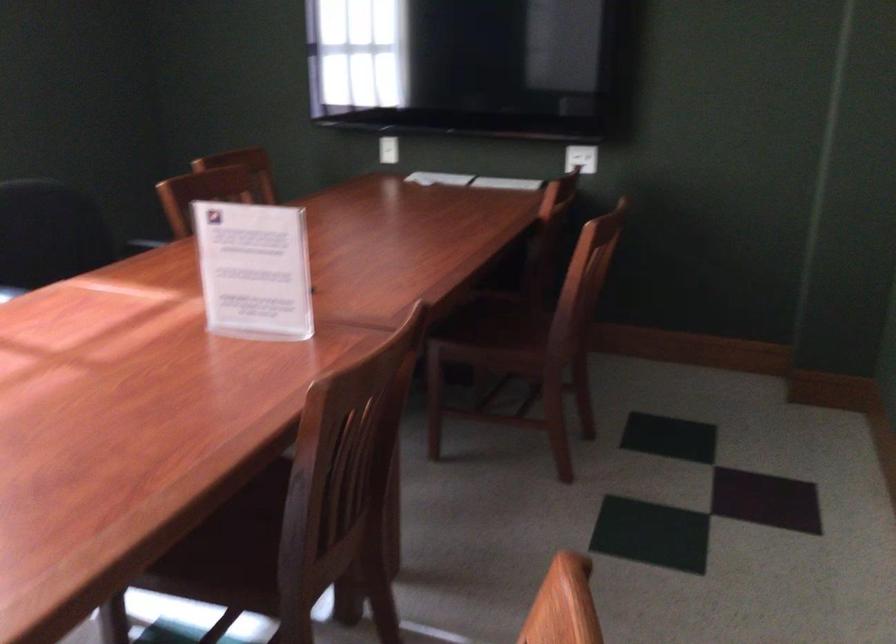
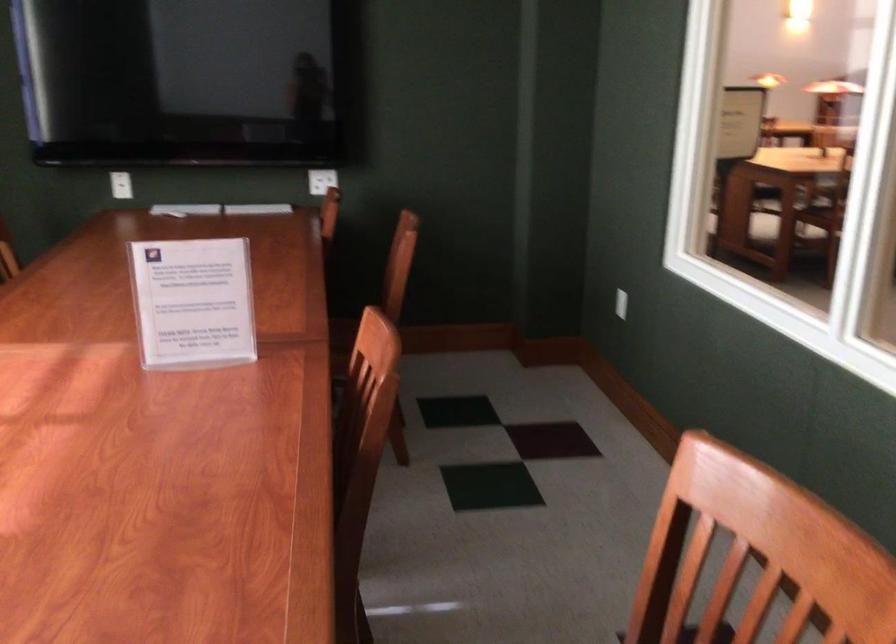
Where in the second image is the point corresponding to the point at 381,149 from the first image?

(121, 185)